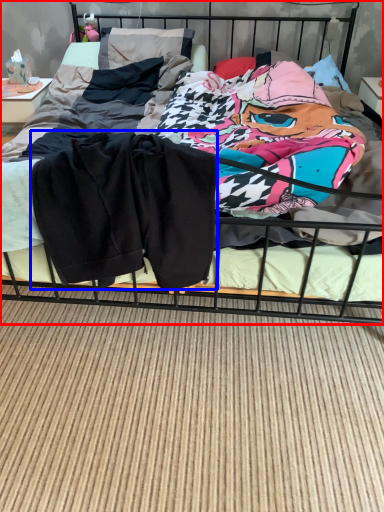
Question: Which object is closer to the camera taking this photo, bed (highlighted by a red box) or baby clothe (highlighted by a blue box)?

Choices:
 (A) bed
 (B) baby clothe

Answer: (A)